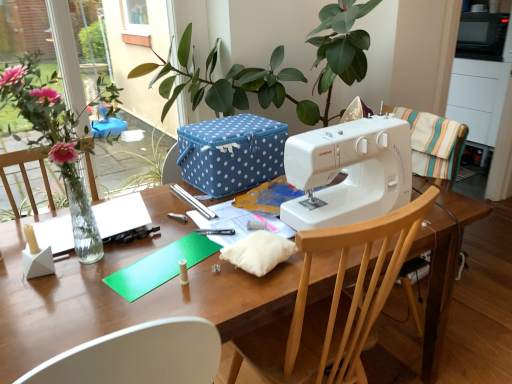
This screenshot has width=512, height=384. Find the location of `vacant region to the left of green leafy plant at left`. vacant region to the left of green leafy plant at left is located at coordinates (26, 246).